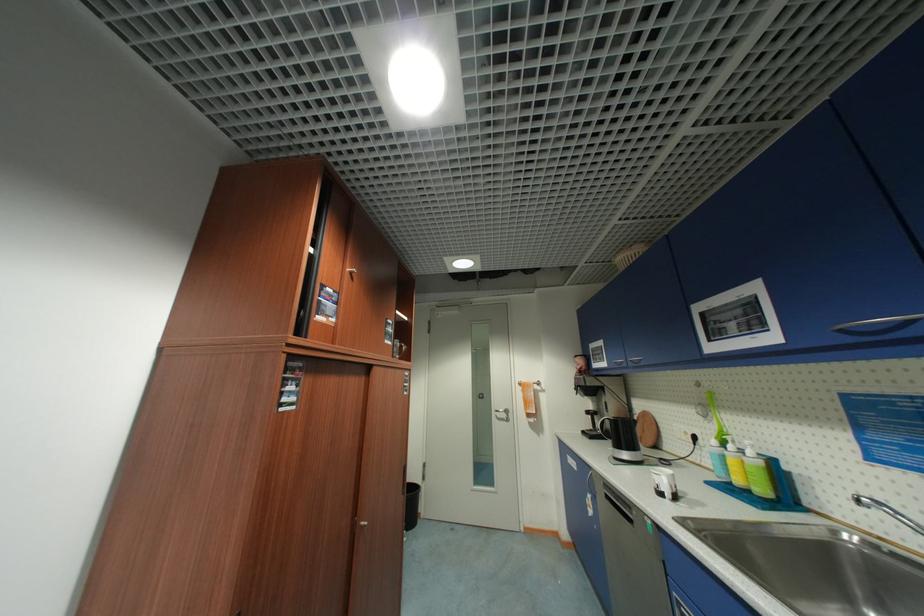
The location [667,488] corresponds to which object?

This point indicates the white coffee mug.